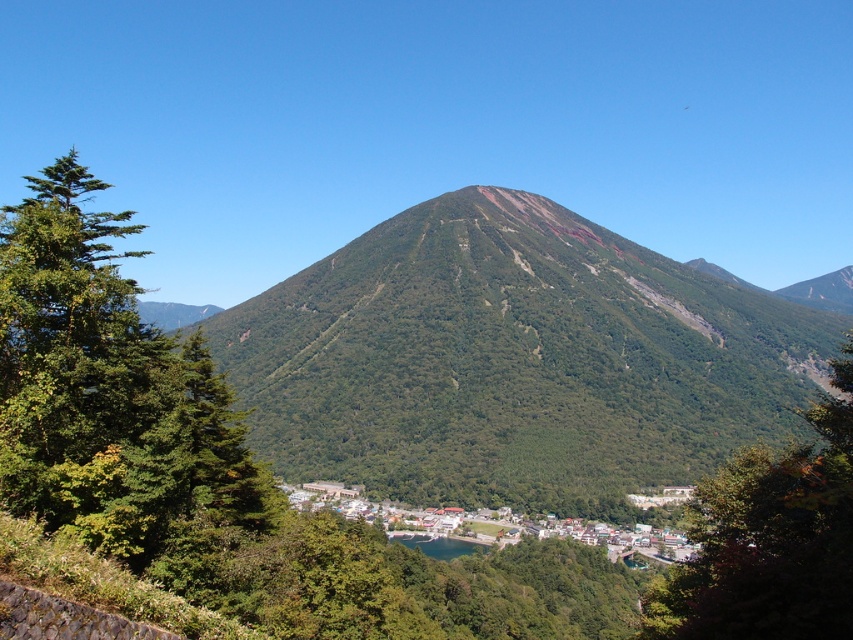
Is green leafy tree at center to the left of green wooden houses at lower center from the viewer's perspective?

In fact, green leafy tree at center is to the right of green wooden houses at lower center.

The height and width of the screenshot is (640, 853). What do you see at coordinates (770, 540) in the screenshot? I see `green leafy tree at center` at bounding box center [770, 540].

This screenshot has width=853, height=640. Find the location of `green leafy tree at center`. green leafy tree at center is located at coordinates (770, 540).

Does green leafy tree at left come behind green leafy tree at center?

Yes.

Between green leafy tree at left and green leafy tree at center, which one is positioned higher?

green leafy tree at left is above.

Does point (28, 333) lie in front of point (762, 456)?

That is True.

At what (x,y) coordinates should I click in order to perform the action: click on green leafy tree at left. Please return your answer as a coordinate pair (x, y). Looking at the image, I should click on (108, 390).

Based on the photo, is green leafy mountain at center wider than green leafy tree at left?

Indeed, green leafy mountain at center has a greater width compared to green leafy tree at left.

This screenshot has width=853, height=640. I want to click on green leafy mountain at center, so click(514, 360).